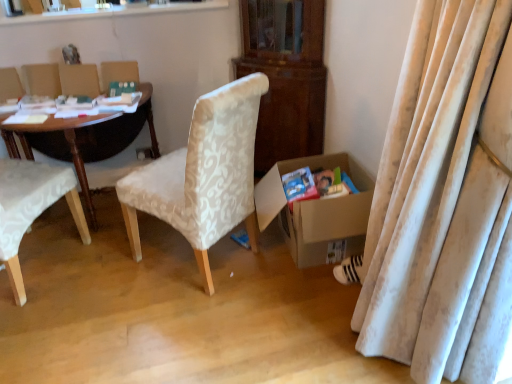
Question: Could white textured fabric chair at center, which is the second chair in left-to-right order, be considered to be inside green matte paperback book at upper left, which is the 2th paperback book in bottom-to-top order?

Choices:
 (A) yes
 (B) no

Answer: (B)

Question: Does green matte paperback book at upper left, placed as the 2th paperback book when sorted from right to left, have a larger size compared to white textured fabric chair at center, which is the second chair in left-to-right order?

Choices:
 (A) no
 (B) yes

Answer: (A)

Question: Is green matte paperback book at upper left, which is the 2th paperback book in bottom-to-top order, not within white textured fabric chair at center, which is the second chair in left-to-right order?

Choices:
 (A) no
 (B) yes

Answer: (B)

Question: Is there a large distance between green matte paperback book at upper left, positioned as the first paperback book in top-to-bottom order, and white textured fabric chair at center, which is the second chair in left-to-right order?

Choices:
 (A) no
 (B) yes

Answer: (A)

Question: From a real-world perspective, is green matte paperback book at upper left, placed as the 2th paperback book when sorted from right to left, positioned over white textured fabric chair at center, which is the second chair in left-to-right order, based on gravity?

Choices:
 (A) no
 (B) yes

Answer: (B)

Question: Based on their sizes in the image, would you say green matte paperback book at upper left, which is the 2th paperback book in bottom-to-top order, is bigger or smaller than matte cardboard magazine at lower right?

Choices:
 (A) small
 (B) big

Answer: (A)

Question: Does point (121, 89) appear closer or farther from the camera than point (318, 188)?

Choices:
 (A) closer
 (B) farther

Answer: (B)

Question: Is green matte paperback book at upper left, which is the 2th paperback book in bottom-to-top order, to the left or to the right of matte cardboard magazine at lower right in the image?

Choices:
 (A) left
 (B) right

Answer: (A)

Question: From the image's perspective, is green matte paperback book at upper left, placed as the 2th paperback book when sorted from right to left, above or below matte cardboard magazine at lower right?

Choices:
 (A) below
 (B) above

Answer: (B)

Question: From a real-world perspective, is wooden polished desk at left positioned above or below white striped fabric sneakers at lower right?

Choices:
 (A) above
 (B) below

Answer: (A)

Question: Is wooden polished desk at left spatially inside white striped fabric sneakers at lower right, or outside of it?

Choices:
 (A) inside
 (B) outside

Answer: (B)

Question: From the image's perspective, is wooden polished desk at left located above or below white striped fabric sneakers at lower right?

Choices:
 (A) above
 (B) below

Answer: (A)

Question: Is wooden polished desk at left to the left or to the right of white striped fabric sneakers at lower right in the image?

Choices:
 (A) right
 (B) left

Answer: (B)

Question: Is point (254, 223) positioned closer to the camera than point (0, 258)?

Choices:
 (A) closer
 (B) farther

Answer: (B)

Question: Is white textured fabric chair at center, the 1th chair in the right-to-left sequence, in front of or behind white fabric chair at left, the 2th chair viewed from the right, in the image?

Choices:
 (A) front
 (B) behind

Answer: (B)